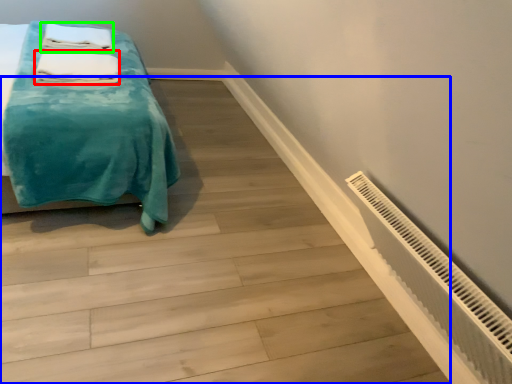
Question: Estimate the real-world distances between objects in this image. Which object is closer to bath towel (highlighted by a red box), stairwell (highlighted by a blue box) or bath towel (highlighted by a green box)?

Choices:
 (A) stairwell
 (B) bath towel

Answer: (B)